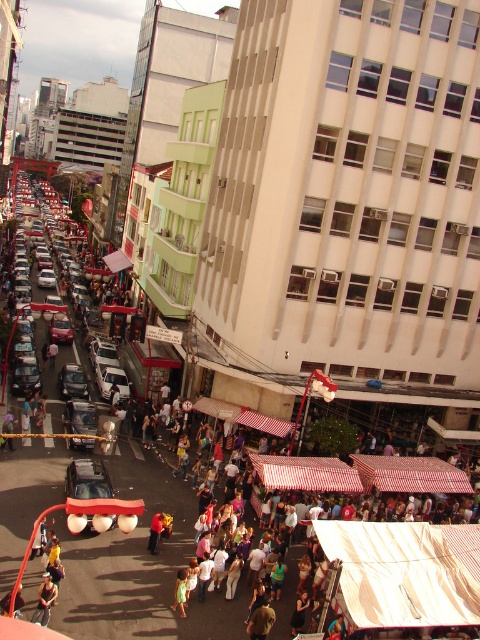
Who is more forward, (162, 522) or (45, 284)?

Point (162, 522) is in front.

Image resolution: width=480 pixels, height=640 pixels. I want to click on red fabric bag at center, so click(156, 531).

Can you confirm if white striped fabric canopy at center is wider than red fabric bag at center?

In fact, white striped fabric canopy at center might be narrower than red fabric bag at center.

Between white striped fabric canopy at center and red fabric bag at center, which one has less height?

white striped fabric canopy at center

Measure the distance between white striped fabric canopy at center and camera.

A distance of 18.85 meters exists between white striped fabric canopy at center and camera.

Locate an element on the screen. The width and height of the screenshot is (480, 640). white striped fabric canopy at center is located at coordinates (405, 572).

Which is above, striped fabric market stall at center or red fabric bag at center?

striped fabric market stall at center

Which is more to the right, striped fabric market stall at center or red fabric bag at center?

striped fabric market stall at center is more to the right.

Between point (380, 614) and point (162, 513), which one is positioned in front?

Point (380, 614) is more forward.

Locate an element on the screen. The width and height of the screenshot is (480, 640). striped fabric market stall at center is located at coordinates (400, 564).